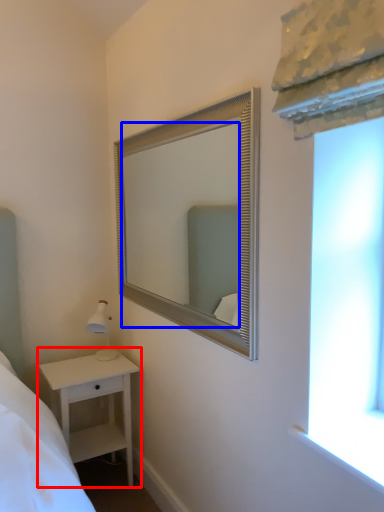
Question: Which point is further to the camera, nightstand (highlighted by a red box) or mirror (highlighted by a blue box)?

Choices:
 (A) nightstand
 (B) mirror

Answer: (A)